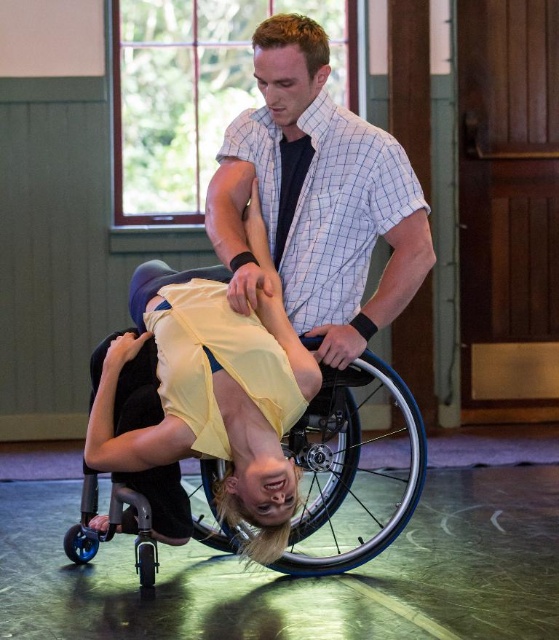
Question: Is white checkered shirt at center wider than black plastic wheelchair at center?

Choices:
 (A) no
 (B) yes

Answer: (A)

Question: Can you confirm if white checkered shirt at center is positioned below black plastic wheelchair at center?

Choices:
 (A) yes
 (B) no

Answer: (B)

Question: Does white checkered shirt at center have a lesser width compared to black plastic wheelchair at center?

Choices:
 (A) yes
 (B) no

Answer: (A)